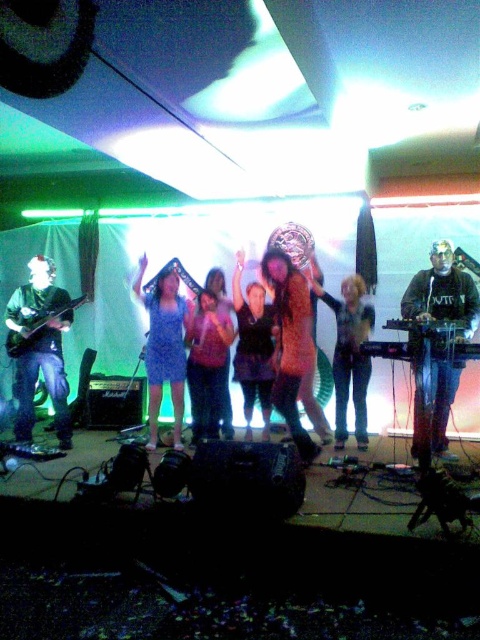
Does black matte keyboard at center appear on the right side of shiny gold dress at center?

Yes, black matte keyboard at center is to the right of shiny gold dress at center.

Is black matte keyboard at center bigger than shiny gold dress at center?

Indeed, black matte keyboard at center has a larger size compared to shiny gold dress at center.

Locate an element on the screen. The width and height of the screenshot is (480, 640). black matte keyboard at center is located at coordinates (443, 292).

What are the coordinates of `black matte keyboard at center` in the screenshot? It's located at (443, 292).

Can you confirm if black matte keyboard at center is positioned to the right of matte black electric guitar at left?

Indeed, black matte keyboard at center is positioned on the right side of matte black electric guitar at left.

Is point (458, 328) farther from camera compared to point (52, 314)?

No, (458, 328) is in front of (52, 314).

Where is `black matte keyboard at center`? black matte keyboard at center is located at coordinates (443, 292).

Does shiny brown dress at center appear on the left side of matte pink dress at center?

In fact, shiny brown dress at center is to the right of matte pink dress at center.

Which is more to the right, shiny brown dress at center or matte pink dress at center?

shiny brown dress at center is more to the right.

Who is more forward, (299, 304) or (194, 396)?

Point (299, 304)

This screenshot has height=640, width=480. Identify the location of shiny brown dress at center. (290, 342).